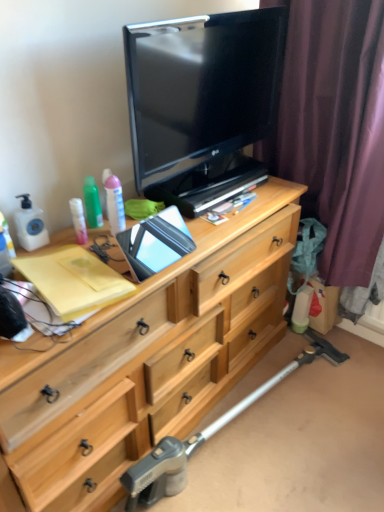
Question: Is metallic silver crutch at lower center wider than light wood chest of drawers at center?

Choices:
 (A) yes
 (B) no

Answer: (B)

Question: Is the position of metallic silver crutch at lower center more distant than that of light wood chest of drawers at center?

Choices:
 (A) no
 (B) yes

Answer: (B)

Question: Considering the relative sizes of metallic silver crutch at lower center and light wood chest of drawers at center in the image provided, is metallic silver crutch at lower center taller than light wood chest of drawers at center?

Choices:
 (A) no
 (B) yes

Answer: (A)

Question: Is light wood chest of drawers at center at the back of metallic silver crutch at lower center?

Choices:
 (A) no
 (B) yes

Answer: (B)

Question: From the image's perspective, is metallic silver crutch at lower center located beneath light wood chest of drawers at center?

Choices:
 (A) yes
 (B) no

Answer: (A)

Question: Is metallic silver crutch at lower center aimed at light wood chest of drawers at center?

Choices:
 (A) no
 (B) yes

Answer: (A)

Question: Can you confirm if matte black tv at upper center is smaller than metallic silver crutch at lower center?

Choices:
 (A) no
 (B) yes

Answer: (B)

Question: Would you say matte black tv at upper center is a long distance from metallic silver crutch at lower center?

Choices:
 (A) no
 (B) yes

Answer: (B)

Question: From a real-world perspective, is matte black tv at upper center located higher than metallic silver crutch at lower center?

Choices:
 (A) no
 (B) yes

Answer: (B)

Question: Considering the relative sizes of matte black tv at upper center and metallic silver crutch at lower center in the image provided, is matte black tv at upper center bigger than metallic silver crutch at lower center?

Choices:
 (A) no
 (B) yes

Answer: (A)

Question: Is matte black tv at upper center aimed at metallic silver crutch at lower center?

Choices:
 (A) yes
 (B) no

Answer: (B)

Question: Is metallic silver crutch at lower center located within matte black tv at upper center?

Choices:
 (A) no
 (B) yes

Answer: (A)

Question: Is metallic silver crutch at lower center located outside matte black tv at upper center?

Choices:
 (A) no
 (B) yes

Answer: (B)